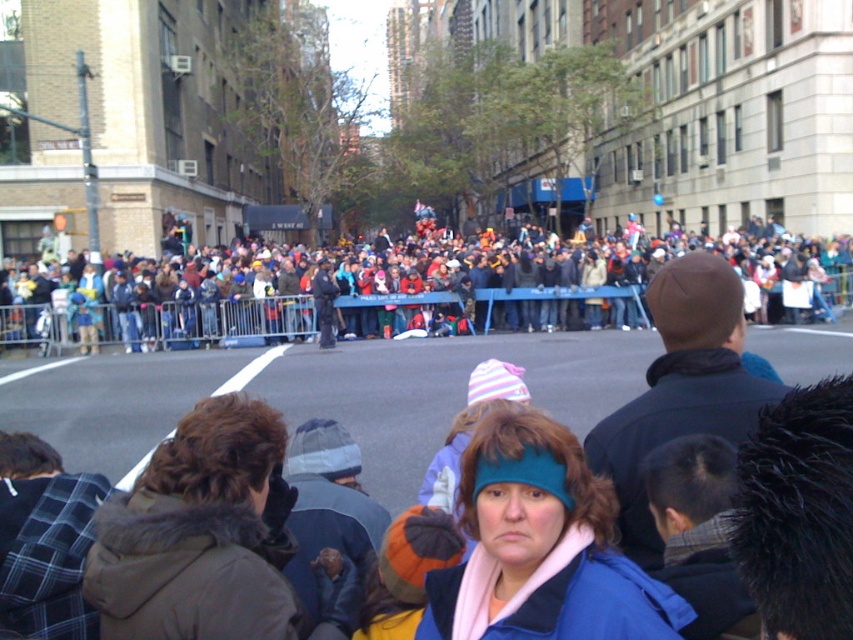
You are a photographer standing in the middle of the street. You want to take a photo of the blue fleece jacket at center without the multicolored fabric crowd at center blocking it. Is this possible?

The multicolored fabric crowd at center is further to the viewer than the blue fleece jacket at center, so the blue fleece jacket at center is behind the crowd. Therefore, you cannot take a photo of the blue fleece jacket at center without the multicolored fabric crowd at center blocking it.

Based on the photo, you are standing at the edge of the street and see the multicolored fabric crowd at center and the blue fleece jacket at center. Which object is positioned to the right of the other?

The multicolored fabric crowd at center is to the right of blue fleece jacket at center.

You are a street performer who needs to reach the multicolored fabric crowd at center. You are currently standing 10 feet away from them. Can you reach them without moving closer?

The multicolored fabric crowd at center and viewer are 11.39 feet apart. Since you are 10 feet away, you cannot reach them without moving closer as the distance is greater than your current position.